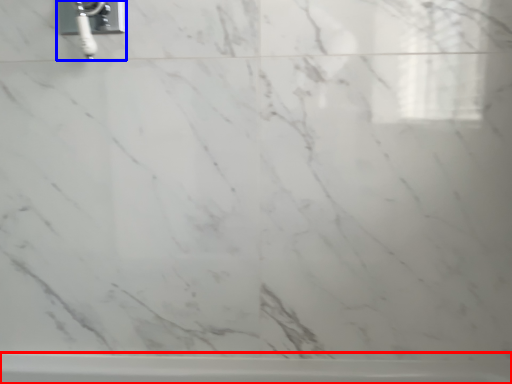
Question: Which object is further to the camera taking this photo, bathtub (highlighted by a red box) or plumbing fixture (highlighted by a blue box)?

Choices:
 (A) bathtub
 (B) plumbing fixture

Answer: (A)